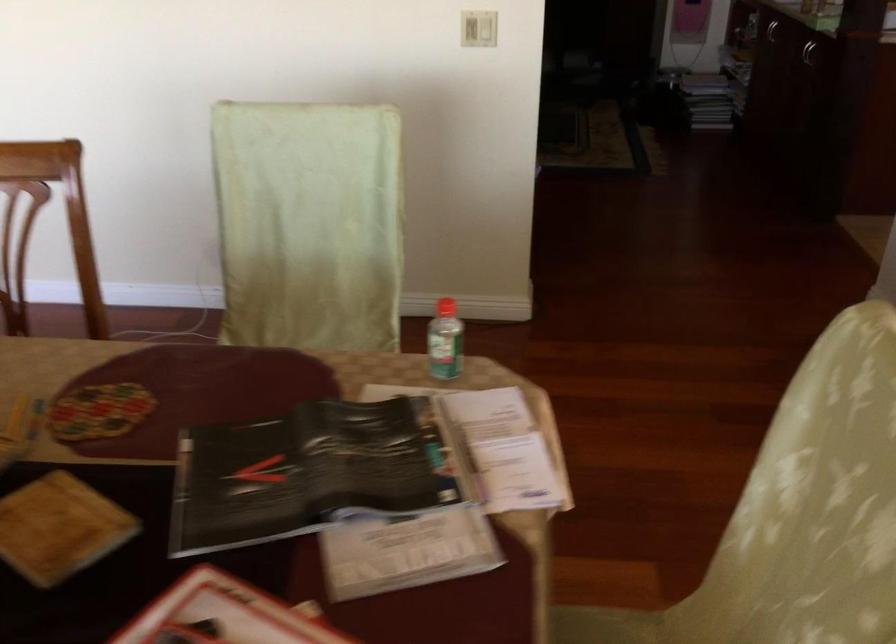
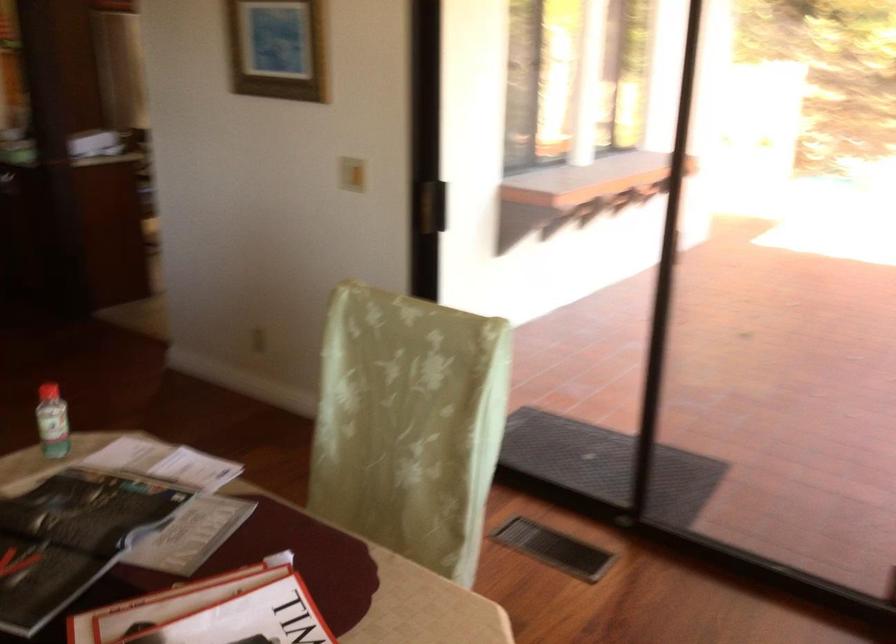
Question: How did the camera likely rotate?

Choices:
 (A) Left
 (B) Right
 (C) Up
 (D) Down

Answer: (B)